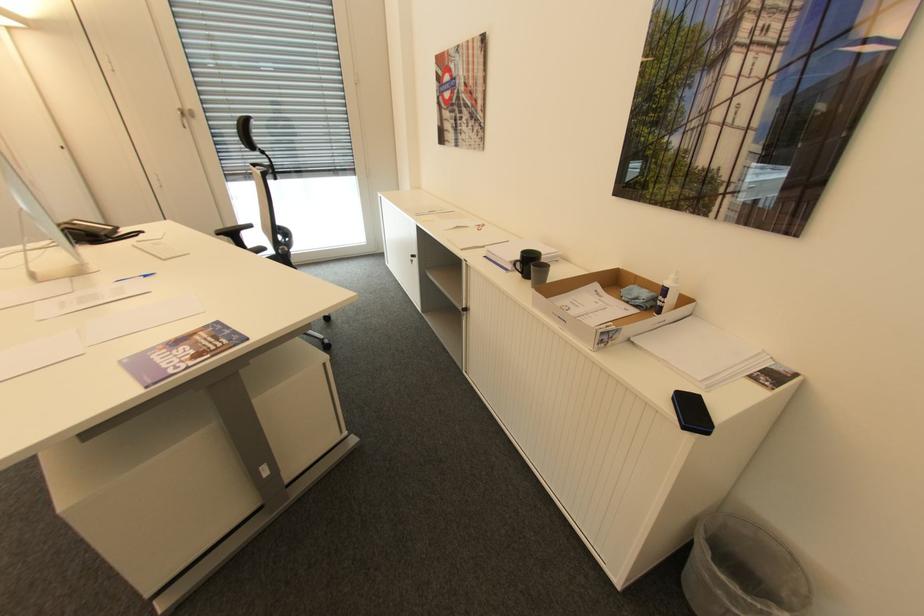
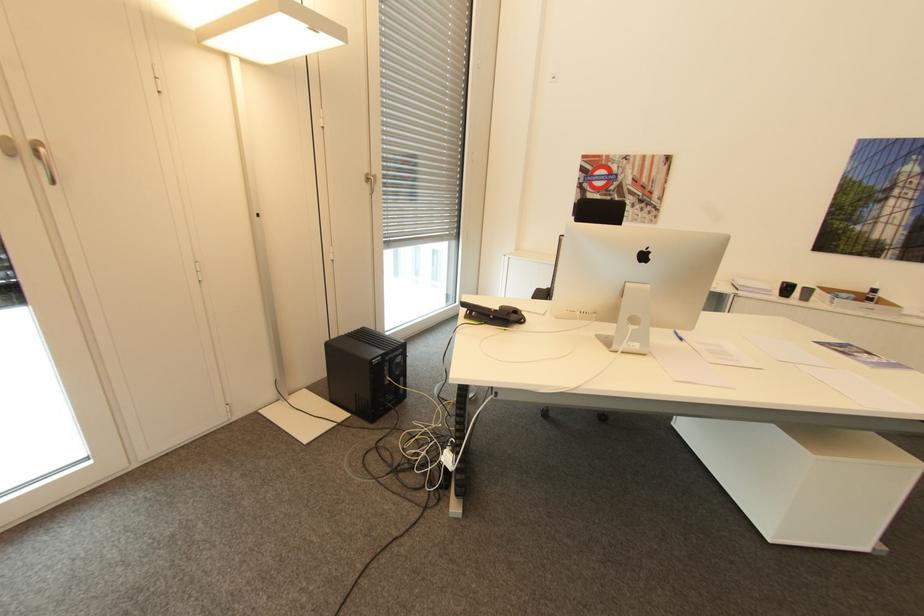
The point at (529, 252) is marked in the first image. Where is the corresponding point in the second image?

(788, 283)